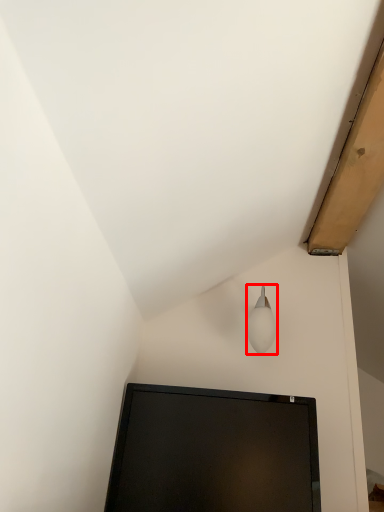
Question: Observing the image, what is the correct spatial positioning of lamp (annotated by the red box) in reference to computer monitor?

Choices:
 (A) left
 (B) right

Answer: (B)